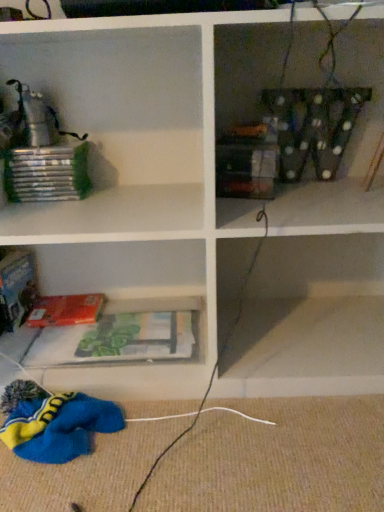
Where is `vacant space situated above matte plastic books at lower center (from a real-world perspective)`? The height and width of the screenshot is (512, 384). vacant space situated above matte plastic books at lower center (from a real-world perspective) is located at coordinates (153, 321).